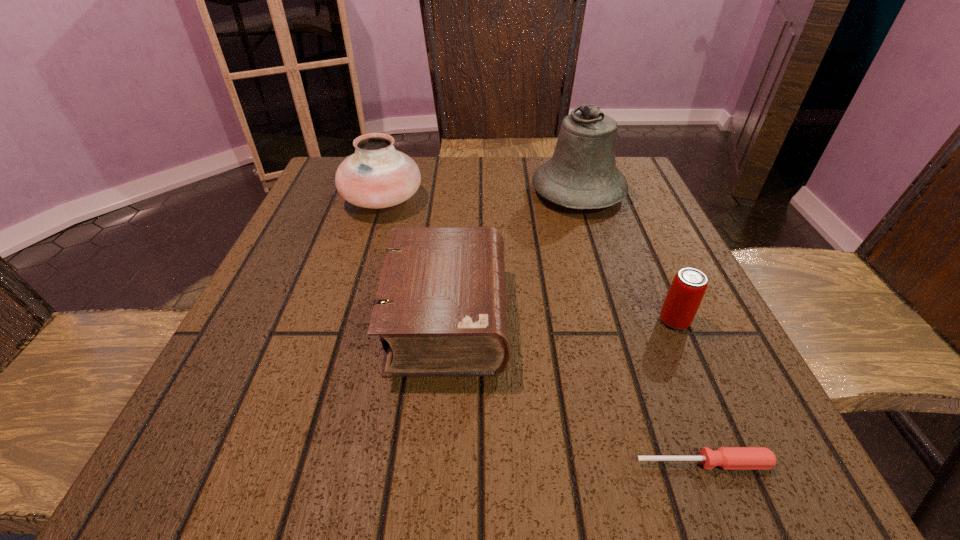
Where is `bell`? The image size is (960, 540). bell is located at coordinates (582, 174).

You are a GUI agent. You are given a task and a screenshot of the screen. Output one action in this format:
    pyautogui.click(x=<x>, y=<y>)
    Task: Click on the pottery
    The height and width of the screenshot is (540, 960).
    Given the screenshot: What is the action you would take?
    pyautogui.click(x=377, y=175)

What are the coordinates of `Bible` in the screenshot? It's located at (441, 308).

Identify the location of beer can. (689, 285).

The height and width of the screenshot is (540, 960). I want to click on screwdriver, so click(x=728, y=458).

Locate an element on the screen. the shortest object is located at coordinates (728, 458).

The width and height of the screenshot is (960, 540). What are the coordinates of `blank space located on the left of the bell` in the screenshot? It's located at (450, 193).

Find the location of a particular element. This screenshot has height=540, width=960. free location located 0.100m on the back of the second tallest object is located at coordinates (395, 160).

Image resolution: width=960 pixels, height=540 pixels. In order to click on blank space located on the spine side of the Bible in this screenshot , I will do `click(660, 317)`.

The height and width of the screenshot is (540, 960). I want to click on vacant space situated 0.270m on the back of the beer can, so click(x=630, y=220).